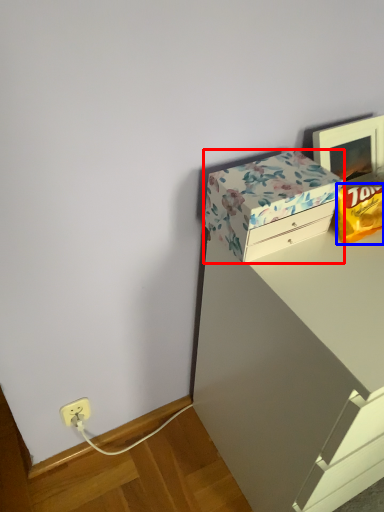
Question: Which point is further to the camera, box (highlighted by a red box) or wrapping paper (highlighted by a blue box)?

Choices:
 (A) box
 (B) wrapping paper

Answer: (B)